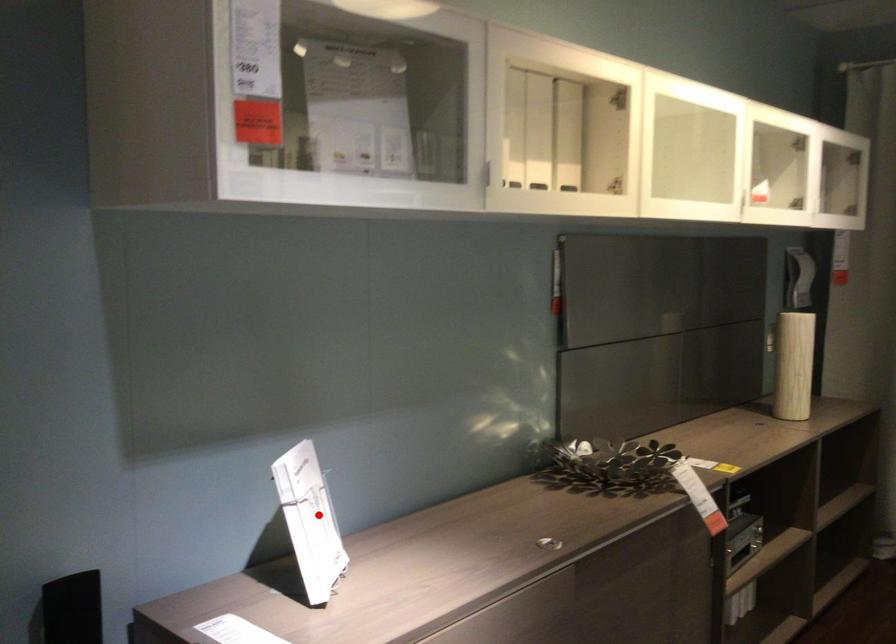
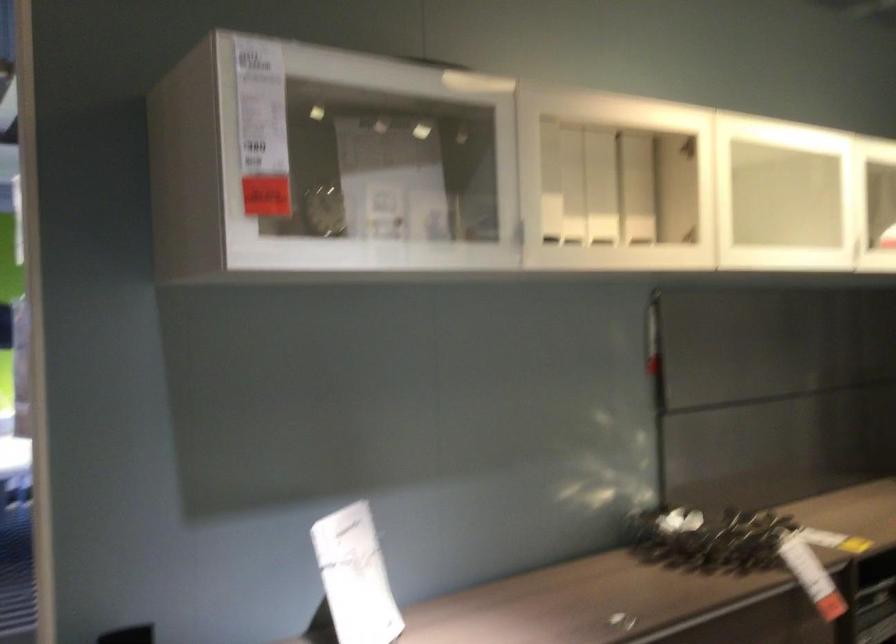
Locate, in the second image, the point that corresponds to the highlighted location in the first image.

(355, 576)